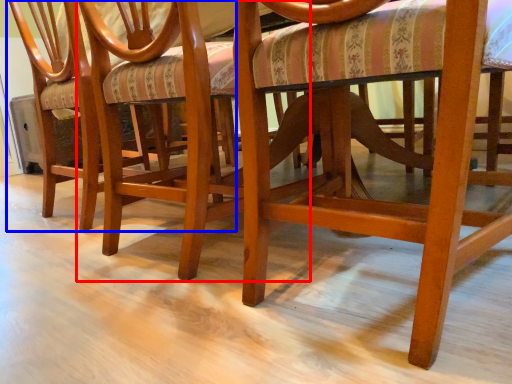
Question: Which object is closer to the camera taking this photo, chair (highlighted by a red box) or chair (highlighted by a blue box)?

Choices:
 (A) chair
 (B) chair

Answer: (A)